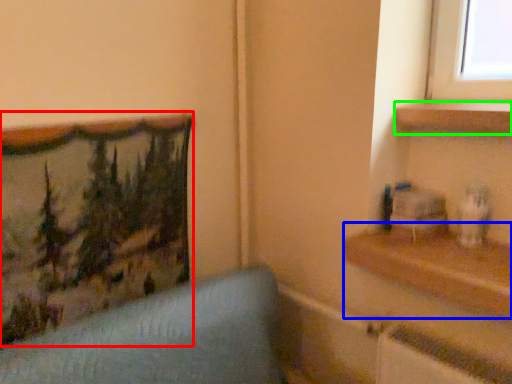
Question: Estimate the real-world distances between objects in this image. Which object is farther from picture frame (highlighted by a red box), shelf (highlighted by a blue box) or shelf (highlighted by a green box)?

Choices:
 (A) shelf
 (B) shelf

Answer: (B)